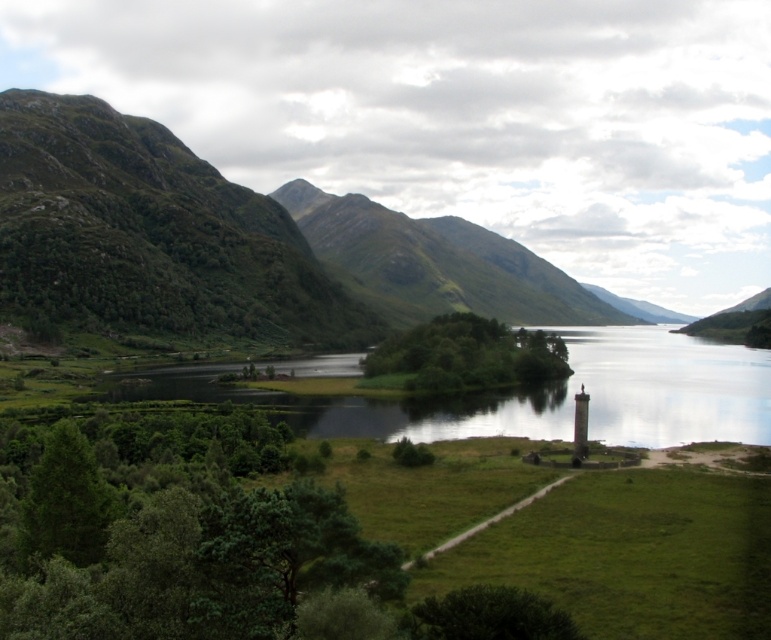
You are standing at the center of the image and want to walk towards the green grassy mountain at left. Which direction should you face?

You should face towards the left direction to walk towards the green grassy mountain at left since it is located at the left side of the image.

You are a hiker who wants to cross from the green leafy tree at lower left to the green grassy water at center. Based on the scene description, which object is taller and could provide a better vantage point for navigation?

The green grassy water at center has a greater height compared to the green leafy tree at lower left, so it would provide a better vantage point for navigation.